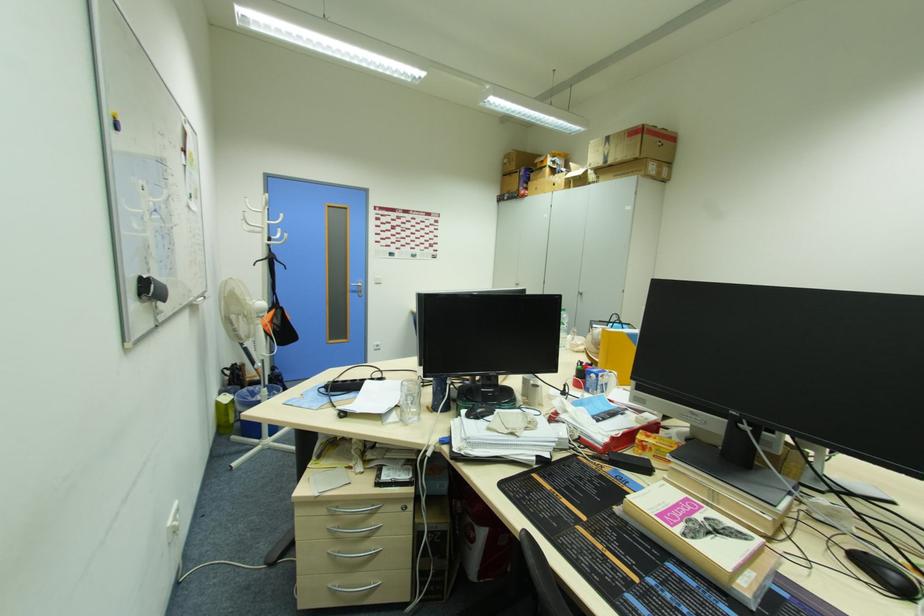
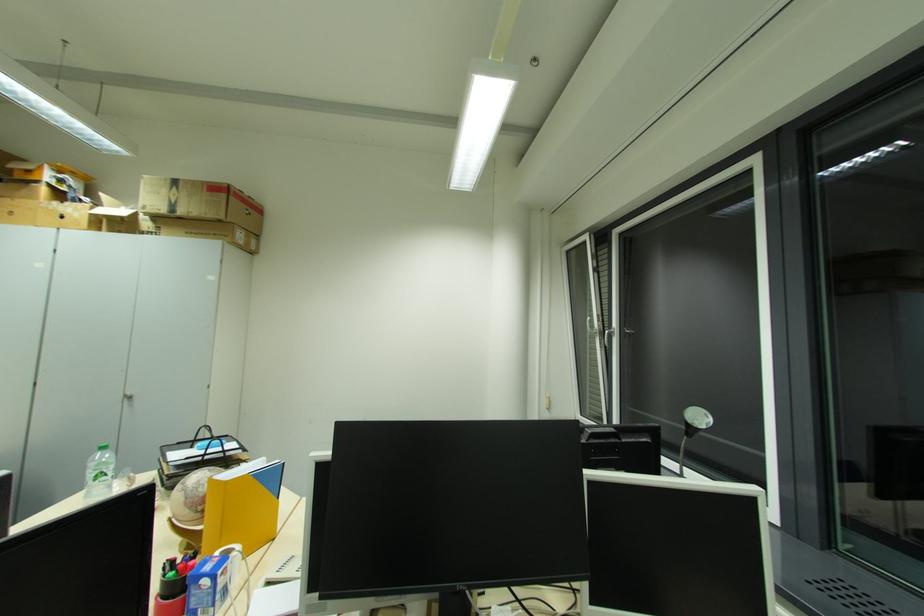
Where in the second image is the point corresponding to [614,326] from the first image?

(202, 445)